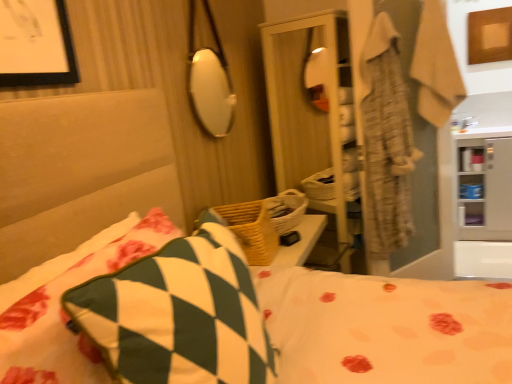
Question: Can you confirm if beige textured robe at upper right is positioned to the left of green and white checkered pillow at lower left, the 1th pillow viewed from the left?

Choices:
 (A) yes
 (B) no

Answer: (B)

Question: From a real-world perspective, is beige textured robe at upper right over green and white checkered pillow at lower left, which is counted as the 2th pillow, starting from the right?

Choices:
 (A) no
 (B) yes

Answer: (B)

Question: Does beige textured robe at upper right contain green and white checkered pillow at lower left, the 1th pillow viewed from the left?

Choices:
 (A) no
 (B) yes

Answer: (A)

Question: Is beige textured robe at upper right closer to camera compared to green and white checkered pillow at lower left, the 1th pillow viewed from the left?

Choices:
 (A) no
 (B) yes

Answer: (A)

Question: From the image's perspective, is beige textured robe at upper right on green and white checkered pillow at lower left, which is counted as the 2th pillow, starting from the right?

Choices:
 (A) no
 (B) yes

Answer: (B)

Question: Could you tell me if beige textured robe at upper right is facing green and white checkered pillow at lower left, which is counted as the 2th pillow, starting from the right?

Choices:
 (A) yes
 (B) no

Answer: (B)

Question: Can you see white glossy cabinet at right touching green and white checkered pillow at center, which is the second pillow from left to right?

Choices:
 (A) yes
 (B) no

Answer: (B)

Question: Could you tell me if white glossy cabinet at right is turned towards green and white checkered pillow at center, the 1th pillow in the right-to-left sequence?

Choices:
 (A) no
 (B) yes

Answer: (B)

Question: Can you confirm if white glossy cabinet at right is taller than green and white checkered pillow at center, which is the second pillow from left to right?

Choices:
 (A) no
 (B) yes

Answer: (B)

Question: From the image's perspective, is white glossy cabinet at right beneath green and white checkered pillow at center, the 1th pillow in the right-to-left sequence?

Choices:
 (A) no
 (B) yes

Answer: (A)

Question: Is white glossy cabinet at right surrounding green and white checkered pillow at center, the 1th pillow in the right-to-left sequence?

Choices:
 (A) yes
 (B) no

Answer: (B)

Question: From the image's perspective, is white glossy cabinet at right over green and white checkered pillow at center, the 1th pillow in the right-to-left sequence?

Choices:
 (A) no
 (B) yes

Answer: (B)

Question: Does white glossy cabinet at right have a greater height compared to beige textured robe at upper right?

Choices:
 (A) yes
 (B) no

Answer: (A)